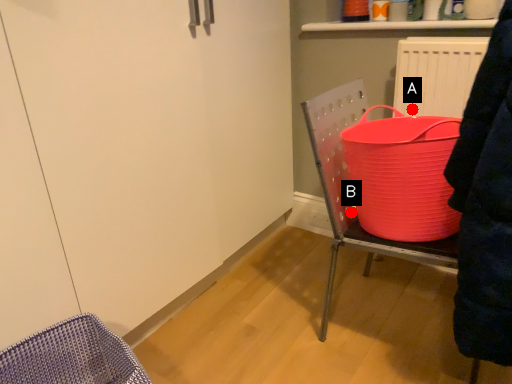
Question: Two points are circled on the image, labeled by A and B beside each circle. Which of the following is the closest to the observer?

Choices:
 (A) A is closer
 (B) B is closer

Answer: (B)